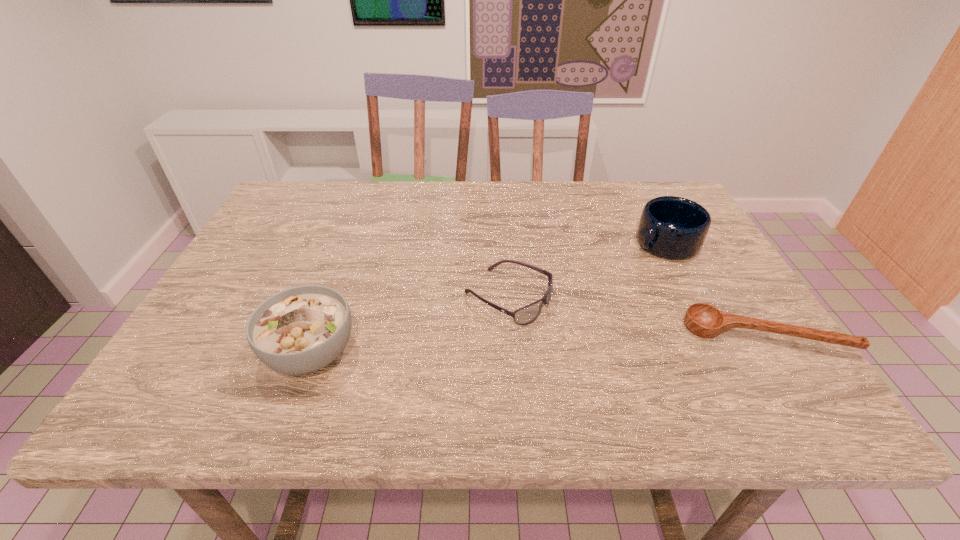
The image size is (960, 540). What are the coordinates of `vacant space located with the handle on the side of the farthest object` in the screenshot? It's located at (544, 315).

Where is `vacant position located 0.050m with the handle on the side of the farthest object`? This screenshot has height=540, width=960. vacant position located 0.050m with the handle on the side of the farthest object is located at coordinates (632, 262).

At what (x,y) coordinates should I click in order to perform the action: click on vacant space located with the handle on the side of the farthest object. Please return your answer as a coordinate pair (x, y). The width and height of the screenshot is (960, 540). Looking at the image, I should click on [x=570, y=299].

Locate an element on the screen. Image resolution: width=960 pixels, height=540 pixels. soup bowl that is at the near edge is located at coordinates (299, 330).

Find the location of `wooden spoon present at the near edge`. wooden spoon present at the near edge is located at coordinates (704, 320).

Locate an element on the screen. The width and height of the screenshot is (960, 540). wooden spoon located in the right edge section of the desktop is located at coordinates (704, 320).

Locate an element on the screen. mug positioned at the right edge is located at coordinates (675, 228).

In order to click on object located in the near right corner section of the desktop in this screenshot , I will do `click(704, 320)`.

Locate an element on the screen. vacant region at the far edge is located at coordinates (593, 210).

You are a GUI agent. You are given a task and a screenshot of the screen. Output one action in this format:
    pyautogui.click(x=<x>, y=<y>)
    Task: Click on the free space at the near edge of the desktop
    Image resolution: width=960 pixels, height=540 pixels.
    Given the screenshot: What is the action you would take?
    pyautogui.click(x=594, y=377)